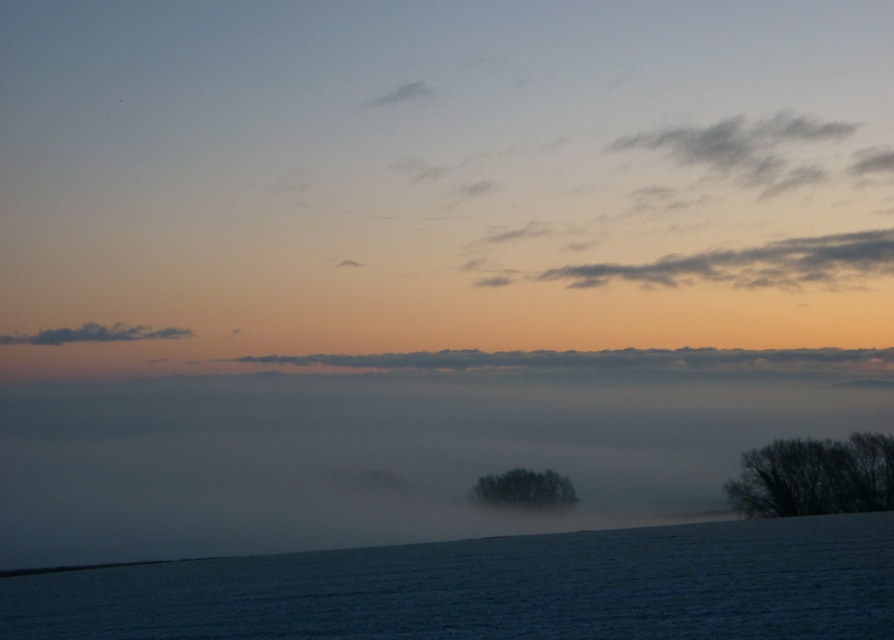
You are an observer standing on the snow covered land in the scene. You see the foggy mist at center and the green matte tree at center. Which object is wider in this view?

The foggy mist at center is wider than the green matte tree at center according to the description.

Based on the scene described, which object is closer to the viewer between the white frosty field at lower center and the gray fluffy cloud at upper right?

The white frosty field at lower center is closer to the viewer than the gray fluffy cloud at upper right because it has a lesser height.